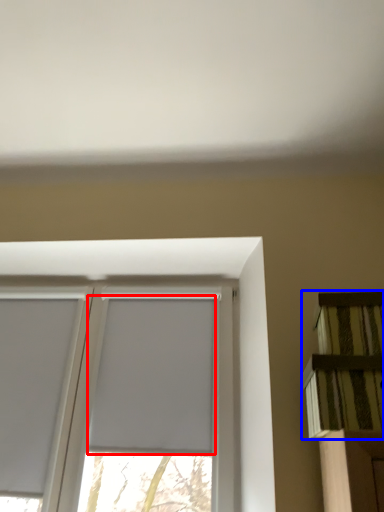
Question: Which of the following is the farthest to the observer, window screen (highlighted by a red box) or shelf (highlighted by a blue box)?

Choices:
 (A) window screen
 (B) shelf

Answer: (A)